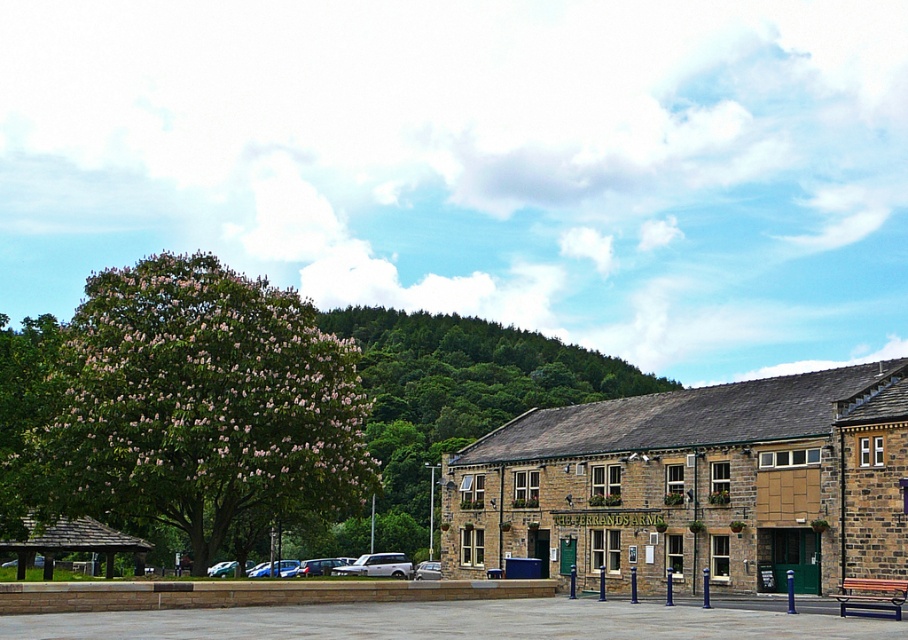
Question: Considering the relative positions of brown stone building at center and metallic park bench at lower right in the image provided, where is brown stone building at center located with respect to metallic park bench at lower right?

Choices:
 (A) below
 (B) above

Answer: (B)

Question: Does brown stone building at center appear on the left side of green leafy tree at left?

Choices:
 (A) yes
 (B) no

Answer: (B)

Question: Which is nearer to the green leafy tree at left?

Choices:
 (A) silver metallic van at center
 (B) brown stone building at center
 (C) metallic park bench at lower right

Answer: (B)

Question: Which of the following is the closest to the observer?

Choices:
 (A) (480, 436)
 (B) (229, 529)

Answer: (B)

Question: Which of the following is the closest to the observer?

Choices:
 (A) brown stone building at center
 (B) silver metallic van at center

Answer: (A)

Question: Is brown stone building at center to the right of silver metallic van at center from the viewer's perspective?

Choices:
 (A) yes
 (B) no

Answer: (A)